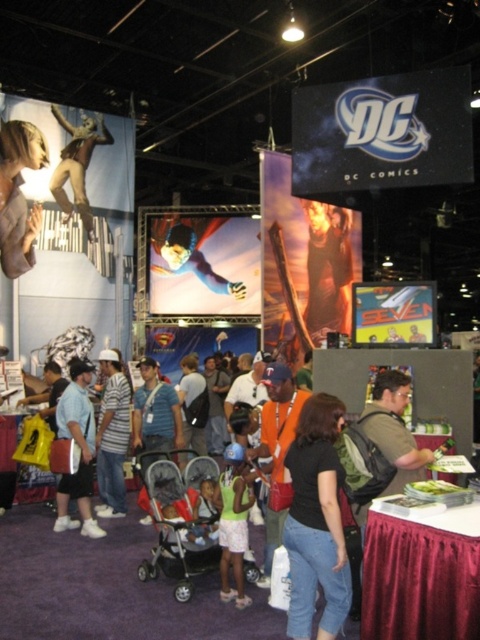
You are a photographer at the event and want to capture both the metallic silver statue at upper left and the blue fabric superman at center in a single photo. Considering their heights, which one should you position closer to the camera to ensure both are fully visible?

The metallic silver statue at upper left is much taller than the blue fabric superman at center, so you should position the metallic silver statue at upper left closer to the camera to ensure both are fully visible.

You are attending a comic convention and want to take a photo of both the metallic silver statue at upper left and the blue fabric superman at center. Which object should you position closer to the camera to include both in your shot?

Since the metallic silver statue at upper left is located above the blue fabric superman at center, you should position the camera closer to the blue fabric superman at center to capture both in the frame.